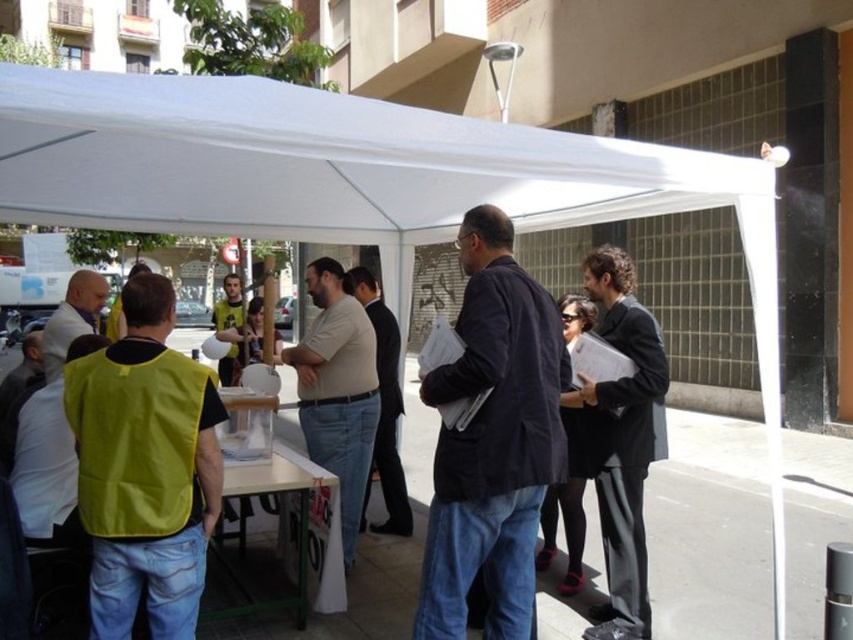
Question: Can you confirm if light brown suit at center is positioned below yellow-green vest at center?

Choices:
 (A) no
 (B) yes

Answer: (B)

Question: Which point is farther to the camera?

Choices:
 (A) (611, 246)
 (B) (358, 435)

Answer: (A)

Question: Which object is closer to the camera taking this photo?

Choices:
 (A) matte white shirt at left
 (B) clear plastic table at center
 (C) matte beige shirt at center

Answer: (B)

Question: Does dark gray suit at center appear under yellow-green vest at center?

Choices:
 (A) no
 (B) yes

Answer: (B)

Question: Considering the relative positions of dark gray suit at center and yellow-green vest at center in the image provided, where is dark gray suit at center located with respect to yellow-green vest at center?

Choices:
 (A) below
 (B) above

Answer: (A)

Question: Which point is farther to the camera?

Choices:
 (A) coord(113,600)
 (B) coord(384,394)
 (C) coord(599,612)

Answer: (B)